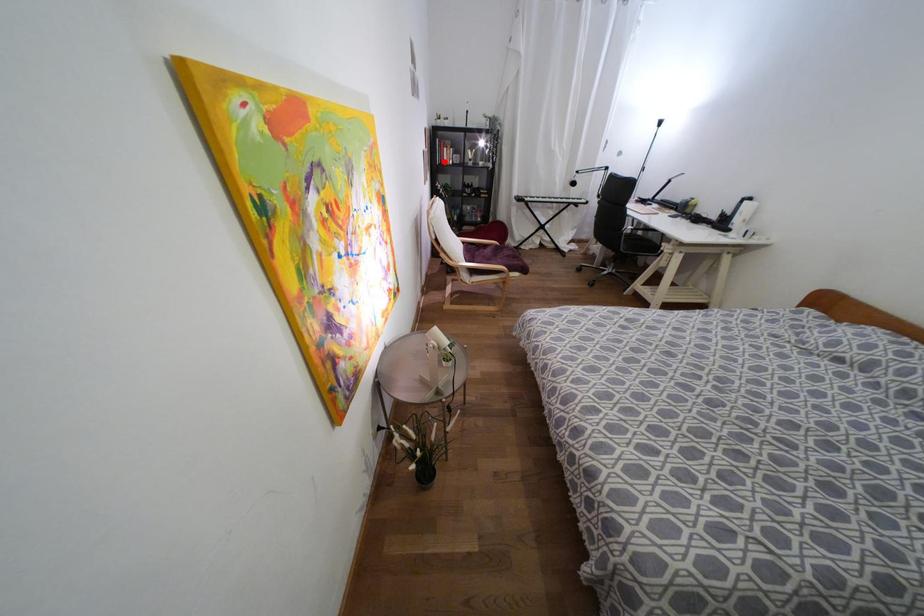
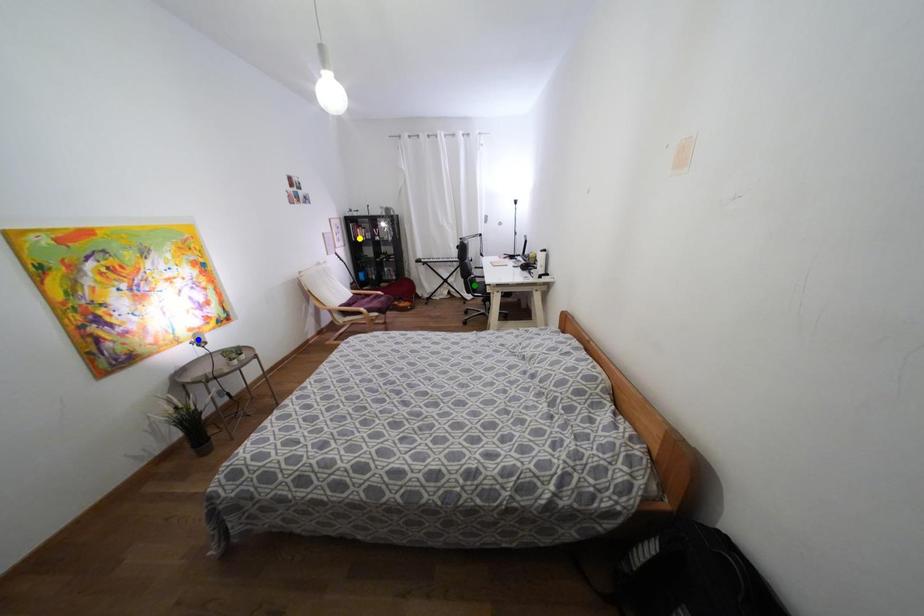
Question: I am providing you with two images of the same scene from different viewpoints. A red point is marked on the first image. You are given multiple points on the second image. Which point in image 2 is actually the same real-world point as the red point in image 1?

Choices:
 (A) green point
 (B) blue point
 (C) yellow point

Answer: (C)